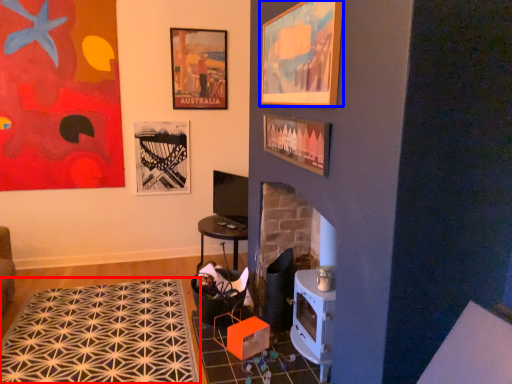
Question: Which of the following is the farthest to the observer, mat (highlighted by a red box) or picture frame (highlighted by a blue box)?

Choices:
 (A) mat
 (B) picture frame

Answer: (A)